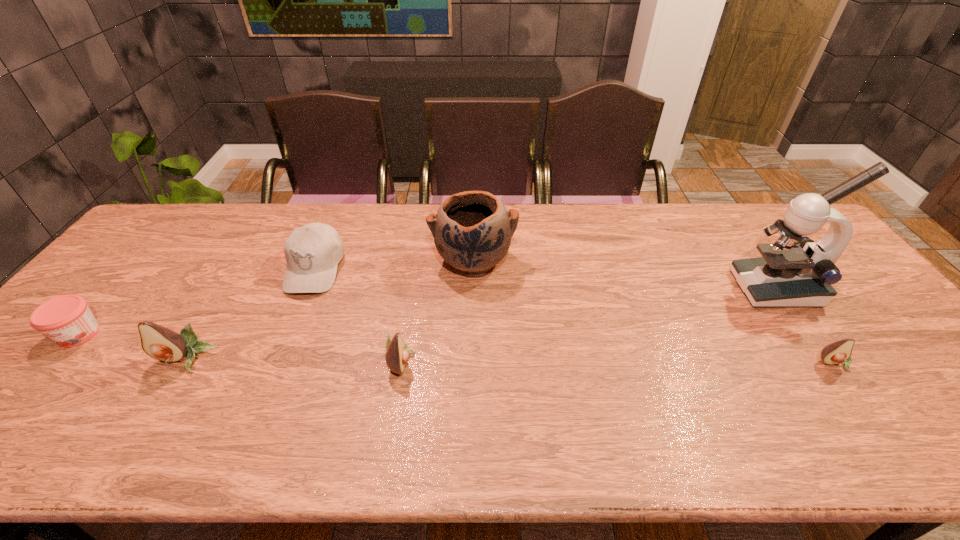
To achieve uniform spacing by inserting another avocado among them, please point to a free space for this new avocado. Please provide its 2D coordinates. Your answer should be formatted as a tuple, i.e. [(x, y)], where the tuple contains the x and y coordinates of a point satisfying the conditions above.

[(617, 362)]